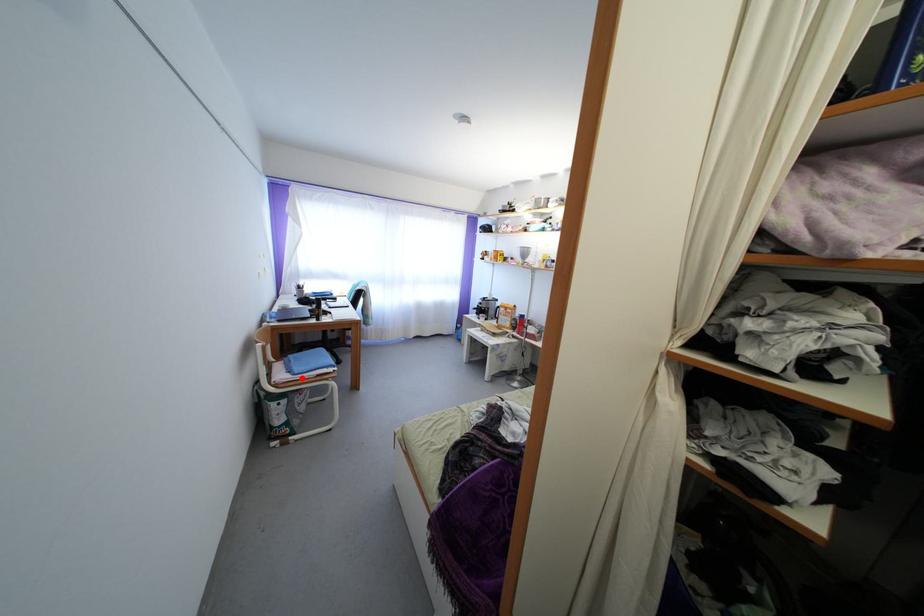
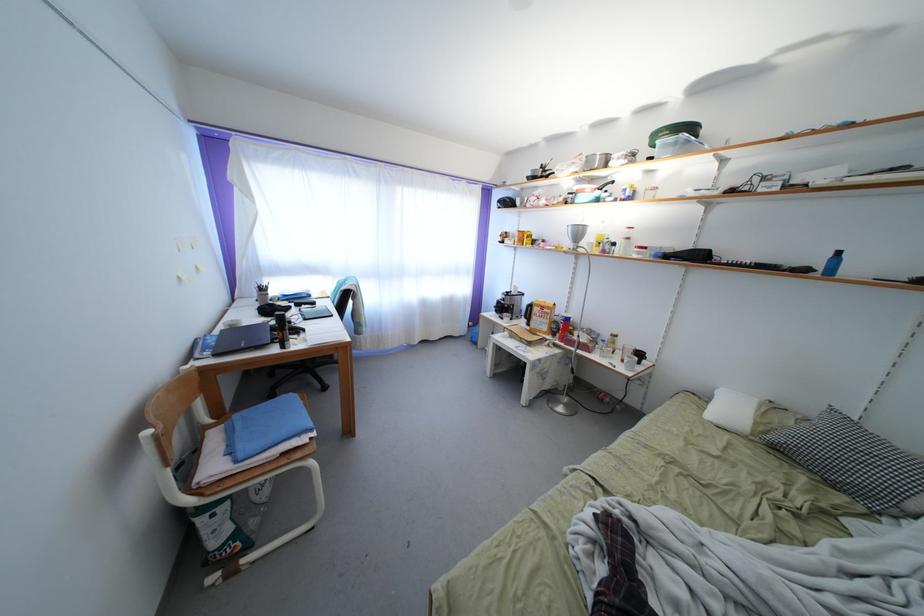
Question: I am providing you with two images of the same scene from different viewpoints. In image1, a red point is highlighted. Considering the same 3D point in image2, which of the following is correct?

Choices:
 (A) It is closer
 (B) It is farther

Answer: (A)